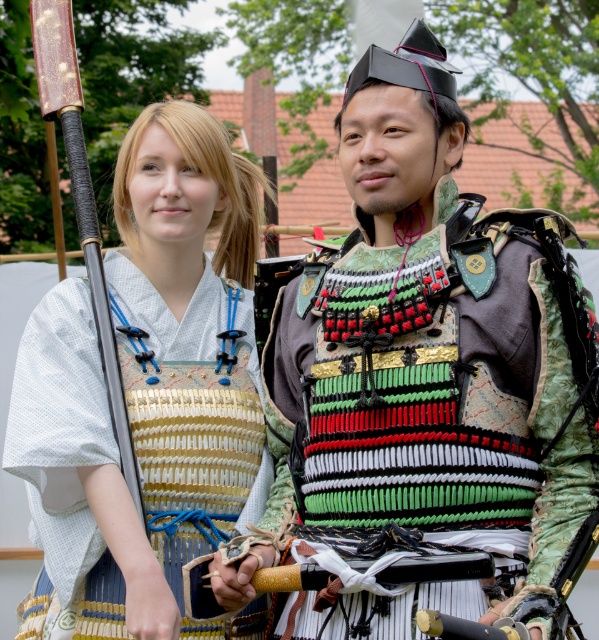
Question: Is knitted fabric armor at center to the left of matte gold armor at center from the viewer's perspective?

Choices:
 (A) yes
 (B) no

Answer: (B)

Question: Which of the following is the closest to the observer?

Choices:
 (A) knitted fabric armor at center
 (B) matte gold armor at center

Answer: (A)

Question: Does knitted fabric armor at center have a smaller size compared to matte gold armor at center?

Choices:
 (A) no
 (B) yes

Answer: (B)

Question: Which point appears closest to the camera in this image?

Choices:
 (A) (75, 563)
 (B) (283, 468)

Answer: (A)

Question: Can you confirm if knitted fabric armor at center is positioned above matte gold armor at center?

Choices:
 (A) yes
 (B) no

Answer: (B)

Question: Among these objects, which one is nearest to the camera?

Choices:
 (A) matte gold armor at center
 (B) knitted fabric armor at center

Answer: (B)